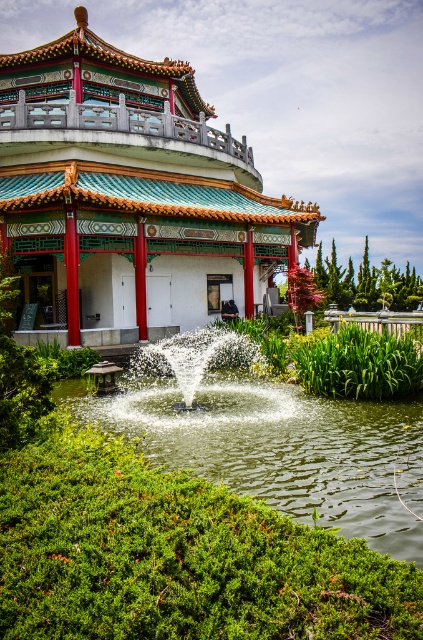
Is teal glazed tiles at center to the right of white frothy water at center from the viewer's perspective?

Incorrect, teal glazed tiles at center is not on the right side of white frothy water at center.

Find the location of a particular element. Image resolution: width=423 pixels, height=640 pixels. teal glazed tiles at center is located at coordinates (129, 196).

Locate an element on the screen. The image size is (423, 640). teal glazed tiles at center is located at coordinates (129, 196).

Locate an element on the screen. teal glazed tiles at center is located at coordinates 129,196.

Is teal glazed tiles at center positioned behind green grassy lake at center?

Yes, it is.

Does teal glazed tiles at center have a lesser width compared to green grassy lake at center?

No.

Does point (312, 234) come behind point (301, 468)?

Yes, it is behind point (301, 468).

I want to click on teal glazed tiles at center, so click(129, 196).

Does green grassy lake at center appear on the left side of white frothy water at center?

In fact, green grassy lake at center is to the right of white frothy water at center.

Who is more forward, (203,476) or (258,419)?

Point (203,476) is in front.

Between point (266, 388) and point (159, 353), which one is positioned in front?

Point (266, 388) is in front.

Locate an element on the screen. The image size is (423, 640). green grassy lake at center is located at coordinates (280, 448).